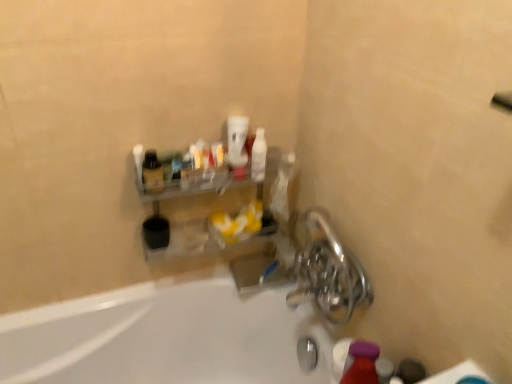
Question: Is clear plastic shelf at upper center at the back of shiny metallic faucet at lower right?

Choices:
 (A) no
 (B) yes

Answer: (A)

Question: Could you tell me if shiny metallic faucet at lower right is turned towards clear plastic shelf at upper center?

Choices:
 (A) no
 (B) yes

Answer: (A)

Question: Is the depth of shiny metallic faucet at lower right greater than that of clear plastic shelf at upper center?

Choices:
 (A) yes
 (B) no

Answer: (B)

Question: Is shiny metallic faucet at lower right not near clear plastic shelf at upper center?

Choices:
 (A) no
 (B) yes

Answer: (A)

Question: From the image's perspective, is shiny metallic faucet at lower right under clear plastic shelf at upper center?

Choices:
 (A) no
 (B) yes

Answer: (B)

Question: Does shiny metallic faucet at lower right have a greater width compared to clear plastic shelf at upper center?

Choices:
 (A) yes
 (B) no

Answer: (A)

Question: Is white glossy cup at upper center, positioned as the 1th mouthwash in left-to-right order, shorter than matte purple bottle at lower right?

Choices:
 (A) no
 (B) yes

Answer: (B)

Question: Is white glossy cup at upper center, which ranks as the 2th mouthwash in right-to-left order, bigger than matte purple bottle at lower right?

Choices:
 (A) yes
 (B) no

Answer: (A)

Question: Is the depth of white glossy cup at upper center, positioned as the 1th mouthwash in left-to-right order, less than that of matte purple bottle at lower right?

Choices:
 (A) no
 (B) yes

Answer: (A)

Question: From the image's perspective, is white glossy cup at upper center, which ranks as the 2th mouthwash in right-to-left order, on top of matte purple bottle at lower right?

Choices:
 (A) yes
 (B) no

Answer: (A)

Question: From a real-world perspective, does white glossy cup at upper center, which ranks as the 2th mouthwash in right-to-left order, sit lower than matte purple bottle at lower right?

Choices:
 (A) no
 (B) yes

Answer: (A)

Question: Is white glossy cup at upper center, positioned as the 1th mouthwash in left-to-right order, completely or partially outside of matte purple bottle at lower right?

Choices:
 (A) no
 (B) yes

Answer: (B)

Question: From the image's perspective, is shiny metallic faucet at lower right located beneath matte black bottle at upper left?

Choices:
 (A) no
 (B) yes

Answer: (B)